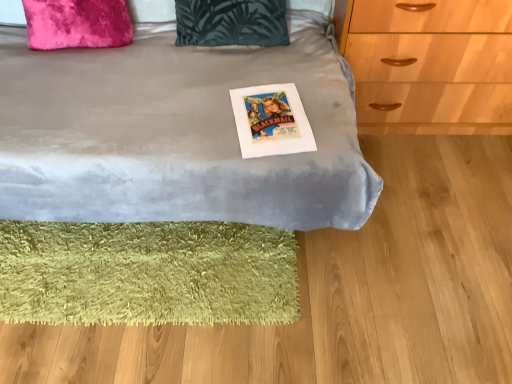
What are the coordinates of `free spot above white paper poster at center (from a real-world perspective)` in the screenshot? It's located at (263, 116).